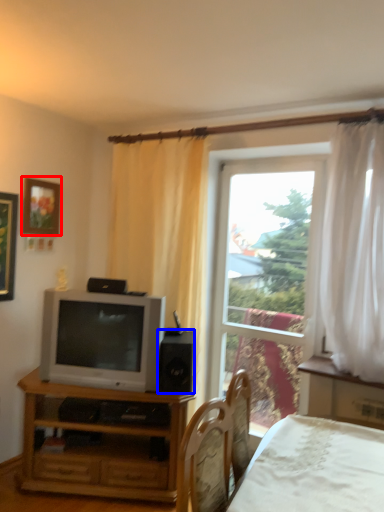
Question: Among these objects, which one is nearest to the camera, picture frame (highlighted by a red box) or speaker (highlighted by a blue box)?

Choices:
 (A) picture frame
 (B) speaker

Answer: (B)